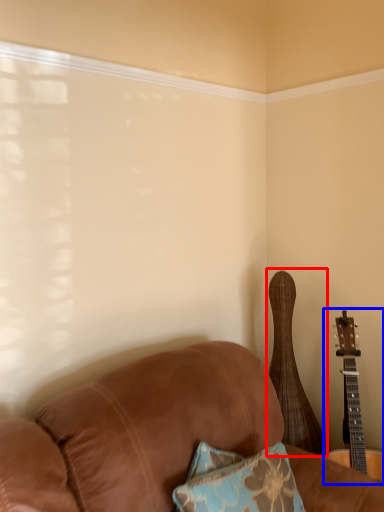
Question: Which object appears closest to the camera in this image, guitar (highlighted by a red box) or guitar (highlighted by a blue box)?

Choices:
 (A) guitar
 (B) guitar

Answer: (B)